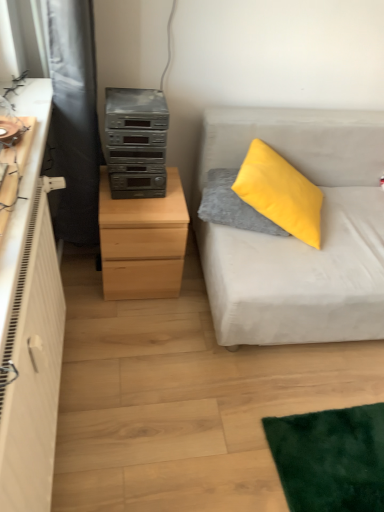
Question: Could you tell me if light wood chest of drawers at left is facing satin silver stereo at center left?

Choices:
 (A) yes
 (B) no

Answer: (B)

Question: Considering the relative positions of light wood chest of drawers at left and satin silver stereo at center left in the image provided, is light wood chest of drawers at left to the right of satin silver stereo at center left from the viewer's perspective?

Choices:
 (A) yes
 (B) no

Answer: (B)

Question: Is light wood chest of drawers at left not close to satin silver stereo at center left?

Choices:
 (A) no
 (B) yes

Answer: (A)

Question: Is light wood chest of drawers at left closer to the viewer compared to satin silver stereo at center left?

Choices:
 (A) no
 (B) yes

Answer: (A)

Question: Is the depth of light wood chest of drawers at left greater than that of satin silver stereo at center left?

Choices:
 (A) yes
 (B) no

Answer: (A)

Question: Based on their positions, is light gray fabric couch at right located to the left or right of satin silver stereo at center left?

Choices:
 (A) left
 (B) right

Answer: (B)

Question: Is light gray fabric couch at right situated inside satin silver stereo at center left or outside?

Choices:
 (A) inside
 (B) outside

Answer: (B)

Question: Considering the positions of light gray fabric couch at right and satin silver stereo at center left in the image, is light gray fabric couch at right bigger or smaller than satin silver stereo at center left?

Choices:
 (A) small
 (B) big

Answer: (B)

Question: Considering their positions, is light gray fabric couch at right located in front of or behind satin silver stereo at center left?

Choices:
 (A) behind
 (B) front

Answer: (B)

Question: From the image's perspective, is light wood chest of drawers at left above or below yellow fuzzy pillow at upper right?

Choices:
 (A) above
 (B) below

Answer: (B)

Question: Is light wood chest of drawers at left situated inside yellow fuzzy pillow at upper right or outside?

Choices:
 (A) outside
 (B) inside

Answer: (A)

Question: Is point (104, 187) closer or farther from the camera than point (238, 202)?

Choices:
 (A) farther
 (B) closer

Answer: (B)

Question: Relative to yellow fuzzy pillow at upper right, is light wood chest of drawers at left in front or behind?

Choices:
 (A) front
 (B) behind

Answer: (A)

Question: In terms of width, does black fabric curtain at left look wider or thinner when compared to light wood chest of drawers at left?

Choices:
 (A) thin
 (B) wide

Answer: (A)

Question: Considering the positions of point (54, 103) and point (168, 230), is point (54, 103) closer or farther from the camera than point (168, 230)?

Choices:
 (A) farther
 (B) closer

Answer: (B)